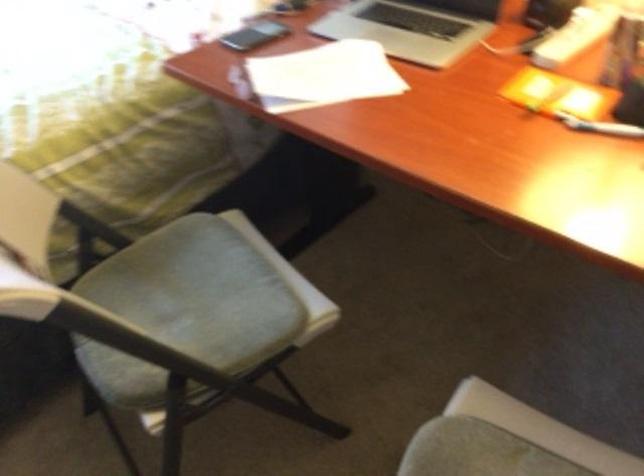
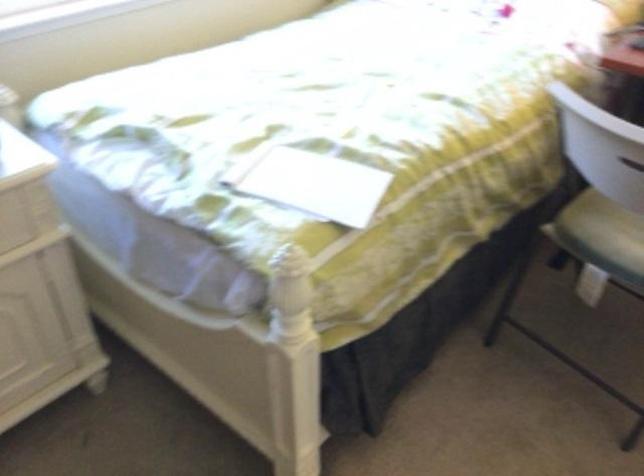
Question: In a continuous first-person perspective shot, in which direction is the camera moving?

Choices:
 (A) Left
 (B) Right
 (C) Forward
 (D) Backward

Answer: (A)